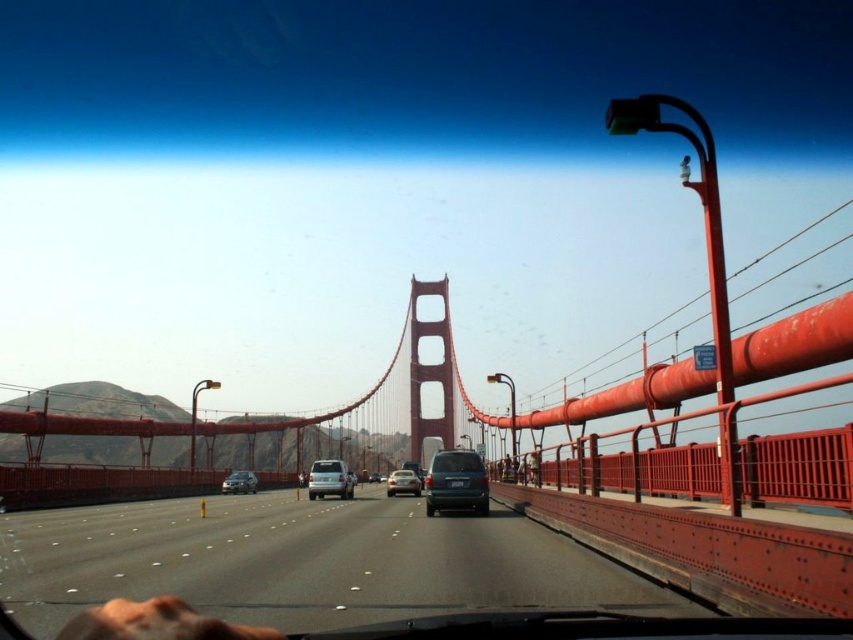
Question: From the image, what is the correct spatial relationship of satin silver sedan at center in relation to silver metallic sedan at center?

Choices:
 (A) above
 (B) below

Answer: (B)

Question: Which point is closer to the camera?

Choices:
 (A) silver metallic sedan at center
 (B) smooth asphalt highway at center
 (C) satin silver van at center

Answer: (B)

Question: Does matte blue van at center appear on the right side of satin silver van at center?

Choices:
 (A) yes
 (B) no

Answer: (A)

Question: Which of these objects is positioned farthest from the satin silver sedan at center?

Choices:
 (A) smooth asphalt highway at center
 (B) silver metallic sedan at center
 (C) satin silver van at center

Answer: (A)

Question: Does smooth asphalt highway at center appear over satin silver van at center?

Choices:
 (A) no
 (B) yes

Answer: (B)

Question: Which point appears farthest from the camera in this image?

Choices:
 (A) (431, 484)
 (B) (229, 484)
 (C) (398, 484)
 (D) (64, 579)

Answer: (B)